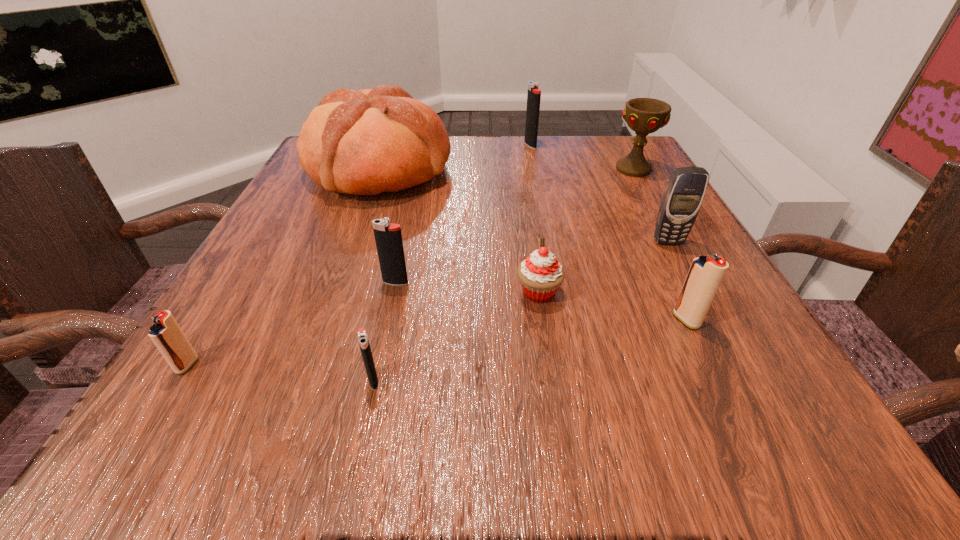
Image resolution: width=960 pixels, height=540 pixels. Find the location of `bread`. bread is located at coordinates (366, 142).

You are a GUI agent. You are given a task and a screenshot of the screen. Output one action in this format:
    pyautogui.click(x=<x>, y=<y>)
    Task: Click on the farthest igniter
    
    Given the screenshot: What is the action you would take?
    pyautogui.click(x=534, y=93)

This screenshot has height=540, width=960. Identify the location of the rightmost black igniter. (534, 93).

This screenshot has width=960, height=540. I want to click on chalice, so click(644, 116).

Identify the location of cellular telephone. (684, 193).

The width and height of the screenshot is (960, 540). Find the location of `the second nearest black igniter`. the second nearest black igniter is located at coordinates (388, 238).

You are a GUI agent. You are given a task and a screenshot of the screen. Output one action in this format:
    pyautogui.click(x=<x>, y=<y>)
    Task: Click on the second biggest black igniter
    Image resolution: width=960 pixels, height=540 pixels.
    Given the screenshot: What is the action you would take?
    pyautogui.click(x=388, y=238)

In order to click on the right red igniter in this screenshot , I will do `click(706, 273)`.

Where is `the farther red igniter`? This screenshot has height=540, width=960. the farther red igniter is located at coordinates (706, 273).

At what (x,y) coordinates should I click in order to perform the action: click on cupcake. Please return your answer as a coordinate pair (x, y). Looking at the image, I should click on (540, 274).